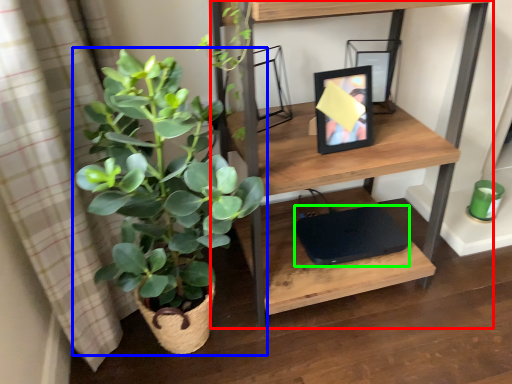
Question: Considering the real-world distances, which object is farthest from shelf (highlighted by a red box)? houseplant (highlighted by a blue box) or computer (highlighted by a green box)?

Choices:
 (A) houseplant
 (B) computer

Answer: (B)